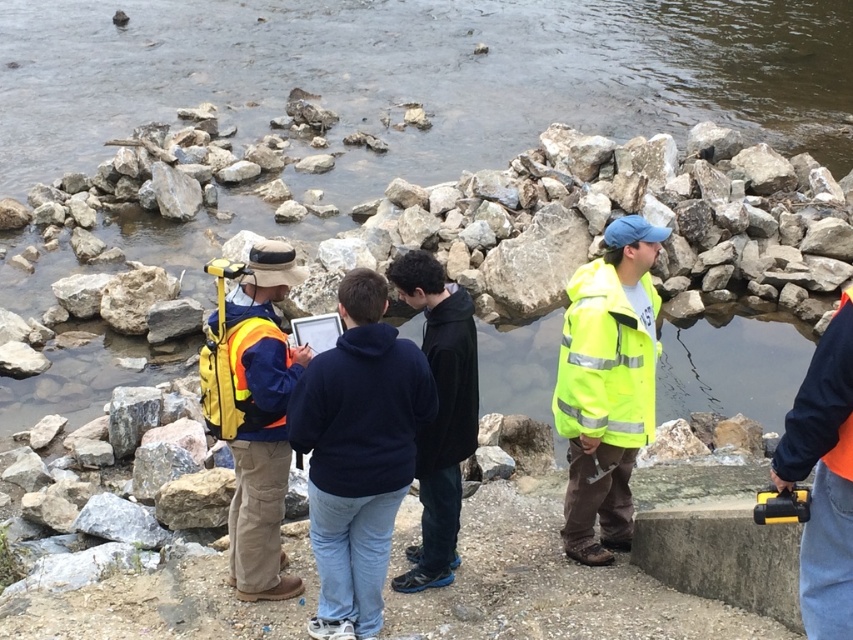
You are a surveyor who needs to place a marker at the exact center of the image. You see the smooth stone stream at center. Where should you place the marker?

The smooth stone stream at center is located at point (421, 76), so place the marker there.

You are part of the survey team and need to locate the orange reflective vest at center and the black matte jacket at center. From your current position, which one is positioned to the left?

The orange reflective vest at center is to the left of black matte jacket at center, so the orange reflective vest at center is positioned to the left.